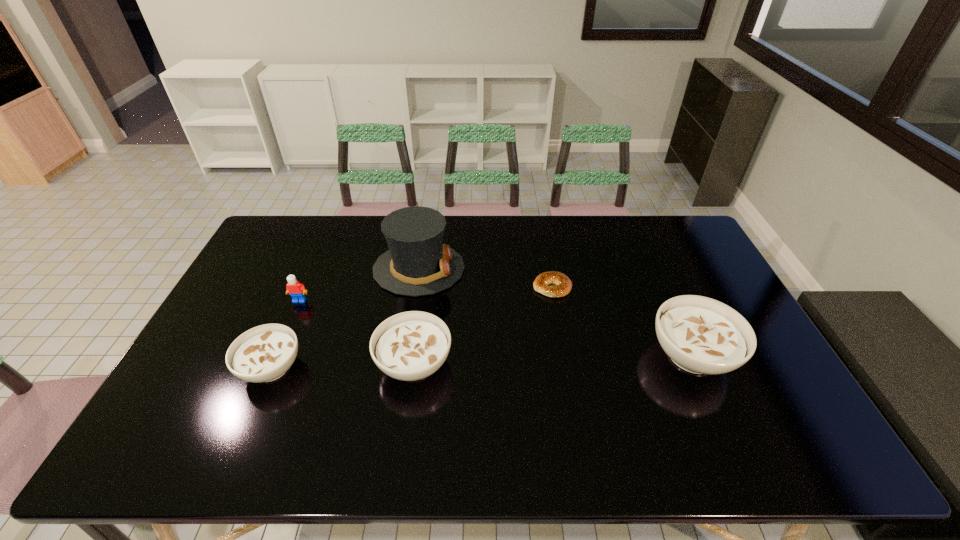
Where is `free spot that satisfies the following two spatial constraints: 1. with goggles on the front of the tallest object; 2. on the right side of the bagel`? free spot that satisfies the following two spatial constraints: 1. with goggles on the front of the tallest object; 2. on the right side of the bagel is located at coordinates (416, 287).

What are the coordinates of `vacant position in the image that satisfies the following two spatial constraints: 1. on the back side of the shortest object; 2. on the left side of the leftmost soup bowl` in the screenshot? It's located at [305, 287].